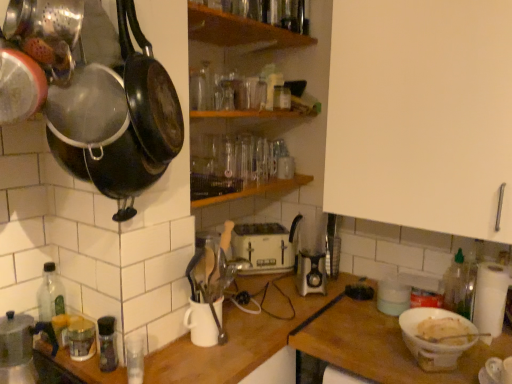
Describe the element at coordinates (149, 92) in the screenshot. I see `black matte frying pan at upper left, which is the 3th frying pan in left-to-right order` at that location.

This screenshot has width=512, height=384. What are the coordinates of `wooden cutting board at center, the second table in the right-to-left sequence` in the screenshot? It's located at (312, 344).

Identify the location of wooden shelf at center, which ranks as the 1th shelf in bottom-to-top order. (257, 190).

In order to face white plastic toaster at center, should I rotate leftwards or rightwards?

A 0.779 degree turn to the right will do.

At what (x,y) coordinates should I click in order to perform the action: click on black matte frying pan at upper left, which is the 3th frying pan in left-to-right order. Please return your answer as a coordinate pair (x, y). The width and height of the screenshot is (512, 384). Looking at the image, I should click on [x=149, y=92].

Who is taller, metallic black frying pan at upper left, the 3th frying pan in the right-to-left sequence, or white matte bowl at lower right, the 1th table viewed from the right?

Standing taller between the two is white matte bowl at lower right, the 1th table viewed from the right.

From the image's perspective, is metallic black frying pan at upper left, the 3th frying pan in the right-to-left sequence, positioned above or below white matte bowl at lower right, the 1th table viewed from the right?

metallic black frying pan at upper left, the 3th frying pan in the right-to-left sequence, is situated higher than white matte bowl at lower right, the 1th table viewed from the right, in the image.

Measure the distance from metallic black frying pan at upper left, positioned as the 1th frying pan in left-to-right order, to white matte bowl at lower right, which ranks as the 2th table in left-to-right order.

The distance of metallic black frying pan at upper left, positioned as the 1th frying pan in left-to-right order, from white matte bowl at lower right, which ranks as the 2th table in left-to-right order, is 3.39 feet.

Based on the photo, would you consider metallic black frying pan at upper left, positioned as the 1th frying pan in left-to-right order, to be distant from white matte bowl at lower right, which ranks as the 2th table in left-to-right order?

Yes, metallic black frying pan at upper left, positioned as the 1th frying pan in left-to-right order, and white matte bowl at lower right, which ranks as the 2th table in left-to-right order, are located far from each other.

From the image's perspective, is black matte frying pan at left, the 2th frying pan when ordered from left to right, above or below clear glass bottle at lower left, placed as the 1th bottle when sorted from front to back?

black matte frying pan at left, the 2th frying pan when ordered from left to right, is situated higher than clear glass bottle at lower left, placed as the 1th bottle when sorted from front to back, in the image.

From the image's perspective, starting from the clear glass bottle at lower left, placed as the 1th bottle when sorted from front to back, which frying pan is the 1st one above? Please provide its 2D coordinates.

[(91, 98)]

Which of these two, black matte frying pan at left, the 2th frying pan when ordered from left to right, or clear glass bottle at lower left, placed as the 1th bottle when sorted from front to back, stands taller?

black matte frying pan at left, the 2th frying pan when ordered from left to right.

Is point (160, 130) positioned in front of point (131, 359)?

Yes, point (160, 130) is in front of point (131, 359).

Looking at their sizes, would you say wooden shelf at center, which ranks as the 1th shelf in bottom-to-top order, is wider or thinner than green plastic bottle at right, acting as the first bottle starting from the back?

wooden shelf at center, which ranks as the 1th shelf in bottom-to-top order, is wider than green plastic bottle at right, acting as the first bottle starting from the back.

From the image's perspective, is wooden shelf at center, which is counted as the 2th shelf, starting from the top, under green plastic bottle at right, acting as the first bottle starting from the back?

No.

From a real-world perspective, starting from the green plastic bottle at right, the 4th bottle positioned from the front, which shelf is the 1st one vertically above it? Please provide its 2D coordinates.

[(257, 190)]

Who is shorter, wooden shelf at center, which ranks as the 1th shelf in bottom-to-top order, or green plastic bottle at right, positioned as the first bottle in right-to-left order?

wooden shelf at center, which ranks as the 1th shelf in bottom-to-top order.

In order to click on shelf that appears above the wooden shelf at center, which ranks as the 1th shelf in bottom-to-top order (from the image's perspective) in this screenshot , I will do `click(239, 31)`.

Between point (255, 36) and point (306, 176), which one is positioned behind?

The point (306, 176) is farther.

From a real-world perspective, which is physically above, wooden shelf at upper center, which is the first shelf in top-to-bottom order, or wooden shelf at center, which is counted as the 2th shelf, starting from the top?

From a 3D spatial view, wooden shelf at upper center, which is the first shelf in top-to-bottom order, is above.

Which object is further away from the camera, wooden shelf at upper center, acting as the second shelf starting from the bottom, or wooden shelf at center, which is counted as the 2th shelf, starting from the top?

Positioned behind is wooden shelf at center, which is counted as the 2th shelf, starting from the top.

Between black matte frying pan at upper left, which is the 3th frying pan in left-to-right order, and wooden cutting board at center, the first table positioned from the left, which one is positioned behind?

wooden cutting board at center, the first table positioned from the left, is further away from the camera.

Can wooden cutting board at center, the second table in the right-to-left sequence, be found inside black matte frying pan at upper left, which is the 3th frying pan in left-to-right order?

No, black matte frying pan at upper left, which is the 3th frying pan in left-to-right order, does not contain wooden cutting board at center, the second table in the right-to-left sequence.

Does black matte frying pan at upper left, which is the 3th frying pan in left-to-right order, have a greater height compared to wooden cutting board at center, the second table in the right-to-left sequence?

No, black matte frying pan at upper left, which is the 3th frying pan in left-to-right order, is not taller than wooden cutting board at center, the second table in the right-to-left sequence.

Who is bigger, black matte frying pan at upper left, which is the 1th frying pan from right to left, or wooden cutting board at center, the first table positioned from the left?

wooden cutting board at center, the first table positioned from the left.

From the picture: Considering the relative sizes of metallic black frying pan at upper left, positioned as the 1th frying pan in left-to-right order, and wooden cutting board at center, the second table in the right-to-left sequence, in the image provided, is metallic black frying pan at upper left, positioned as the 1th frying pan in left-to-right order, taller than wooden cutting board at center, the second table in the right-to-left sequence,?

No.

Starting from the metallic black frying pan at upper left, positioned as the 1th frying pan in left-to-right order, which table is the 1st one behind? Please provide its 2D coordinates.

[(312, 344)]

Is metallic black frying pan at upper left, positioned as the 1th frying pan in left-to-right order, spatially inside wooden cutting board at center, the second table in the right-to-left sequence, or outside of it?

metallic black frying pan at upper left, positioned as the 1th frying pan in left-to-right order, is located beyond the bounds of wooden cutting board at center, the second table in the right-to-left sequence.

Consider the image. Considering the sizes of objects clear glass bottle at lower left, marked as the 2th bottle in a right-to-left arrangement, and wooden shelf at center, which ranks as the 1th shelf in bottom-to-top order, in the image provided, who is taller, clear glass bottle at lower left, marked as the 2th bottle in a right-to-left arrangement, or wooden shelf at center, which ranks as the 1th shelf in bottom-to-top order,?

With more height is clear glass bottle at lower left, marked as the 2th bottle in a right-to-left arrangement.

Are clear glass bottle at lower left, placed as the 1th bottle when sorted from front to back, and wooden shelf at center, which ranks as the 1th shelf in bottom-to-top order, located far from each other?

Actually, clear glass bottle at lower left, placed as the 1th bottle when sorted from front to back, and wooden shelf at center, which ranks as the 1th shelf in bottom-to-top order, are a little close together.

The image size is (512, 384). I want to click on the 1st bottle to the left when counting from the wooden shelf at center, which ranks as the 1th shelf in bottom-to-top order, so click(134, 358).

From a real-world perspective, is clear glass bottle at lower left, which is the fourth bottle in back-to-front order, over wooden shelf at center, which ranks as the 1th shelf in bottom-to-top order?

Actually, clear glass bottle at lower left, which is the fourth bottle in back-to-front order, is physically below wooden shelf at center, which ranks as the 1th shelf in bottom-to-top order, in the real world.

Where is `the 2nd table behind the metallic black frying pan at upper left, the 3th frying pan in the right-to-left sequence, starting your count from the anchor`? This screenshot has width=512, height=384. the 2nd table behind the metallic black frying pan at upper left, the 3th frying pan in the right-to-left sequence, starting your count from the anchor is located at coordinates (380, 345).

Image resolution: width=512 pixels, height=384 pixels. Find the location of `the 1st frying pan above the clear glass bottle at lower left, which is the fourth bottle in back-to-front order (from a real-world perspective)`. the 1st frying pan above the clear glass bottle at lower left, which is the fourth bottle in back-to-front order (from a real-world perspective) is located at coordinates (91, 98).

From the image, which object appears to be farther from white matte bowl at lower right, which ranks as the 2th table in left-to-right order, white plastic toaster at center or green plastic bottle at right, acting as the first bottle starting from the back?

white plastic toaster at center is positioned further to the anchor white matte bowl at lower right, which ranks as the 2th table in left-to-right order.

In the scene shown: Which object lies further to the anchor point translucent glass spice at lower left, which ranks as the 3th bottle in right-to-left order, white matte cabinet at upper right or white plastic toaster at center?

Based on the image, white matte cabinet at upper right appears to be further to translucent glass spice at lower left, which ranks as the 3th bottle in right-to-left order.

Considering their positions, is clear glass bottle at lower left, acting as the 3th bottle starting from the left, positioned closer to clear glass bottle at lower left, positioned as the 2th bottle in back-to-front order, than white matte cabinet at upper right?

clear glass bottle at lower left, acting as the 3th bottle starting from the left, lies closer to clear glass bottle at lower left, positioned as the 2th bottle in back-to-front order, than the other object.

From the image, which object appears to be nearer to clear glass bottle at lower left, which is the 1th bottle from left to right, wooden shelf at upper center, which is the first shelf in top-to-bottom order, or metallic black frying pan at upper left, positioned as the 1th frying pan in left-to-right order?

Based on the image, metallic black frying pan at upper left, positioned as the 1th frying pan in left-to-right order, appears to be nearer to clear glass bottle at lower left, which is the 1th bottle from left to right.

Considering their positions, is black matte frying pan at left, the 2th frying pan when ordered from left to right, positioned further to white matte bowl at lower right than white plastic toaster at center?

black matte frying pan at left, the 2th frying pan when ordered from left to right, is positioned further to the anchor white matte bowl at lower right.

Looking at this image, considering their positions, is translucent glass spice at lower left, arranged as the 3th bottle when viewed from the back, positioned further to clear glass bottle at lower left, placed as the 1th bottle when sorted from front to back, than metallic black frying pan at upper left, the 3th frying pan in the right-to-left sequence?

Based on the image, metallic black frying pan at upper left, the 3th frying pan in the right-to-left sequence, appears to be further to clear glass bottle at lower left, placed as the 1th bottle when sorted from front to back.

In the scene shown: When comparing their distances from white plastic toaster at center, does white matte bowl at lower right or clear glass bottle at lower left, which is the fourth bottle in back-to-front order, seem closer?

Based on the image, white matte bowl at lower right appears to be nearer to white plastic toaster at center.

In the scene shown: From the image, which object appears to be farther from white matte bowl at lower right, wooden shelf at center, which is counted as the 2th shelf, starting from the top, or white matte bowl at lower right, the 1th table viewed from the right?

wooden shelf at center, which is counted as the 2th shelf, starting from the top, lies further to white matte bowl at lower right than the other object.

What are the coordinates of `shelf between wooden shelf at upper center, which is the first shelf in top-to-bottom order, and green plastic bottle at right, which is counted as the 4th bottle, starting from the left, from top to bottom` in the screenshot? It's located at (257, 190).

Identify the location of bottle between metallic black frying pan at upper left, positioned as the 1th frying pan in left-to-right order, and white matte bowl at lower right from left to right. (134, 358).

You are a GUI agent. You are given a task and a screenshot of the screen. Output one action in this format:
    pyautogui.click(x=<x>, y=<y>)
    Task: Click on the bowl between translucent glass spice at lower left, the 2th bottle when ordered from front to back, and white matte bowl at lower right, which ranks as the 2th table in left-to-right order, from left to right
    The height and width of the screenshot is (384, 512).
    Given the screenshot: What is the action you would take?
    pyautogui.click(x=436, y=341)

This screenshot has height=384, width=512. What are the coordinates of `frying pan between metallic black frying pan at upper left, the 3th frying pan in the right-to-left sequence, and clear glass bottle at lower left, which is the fourth bottle in back-to-front order, in the vertical direction` in the screenshot? It's located at (91, 98).